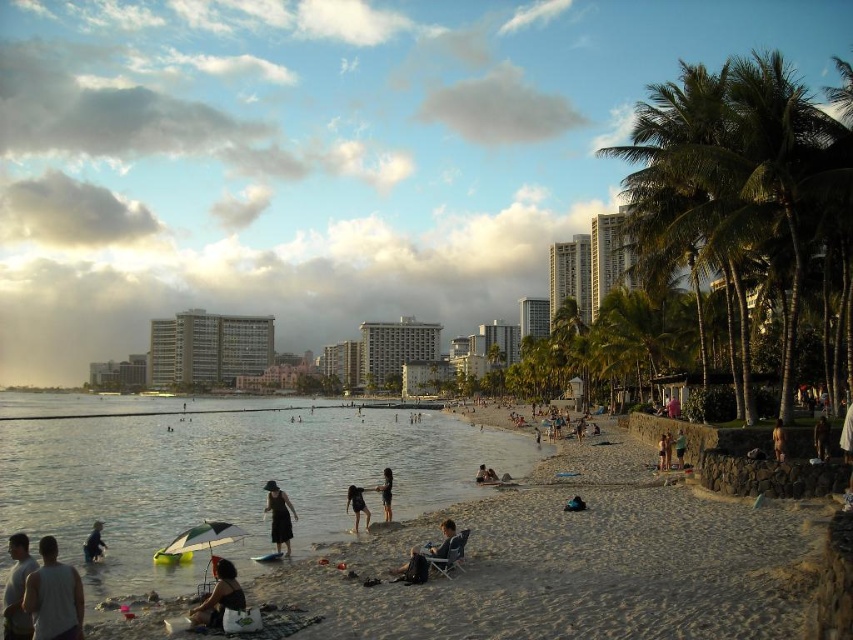
Between white tank top at lower left and dark blue fabric dress at lower center, which one has more height?

With more height is dark blue fabric dress at lower center.

Does white tank top at lower left appear on the left side of dark blue fabric dress at lower center?

Yes, white tank top at lower left is to the left of dark blue fabric dress at lower center.

You are a GUI agent. You are given a task and a screenshot of the screen. Output one action in this format:
    pyautogui.click(x=<x>, y=<y>)
    Task: Click on the white tank top at lower left
    Image resolution: width=853 pixels, height=640 pixels.
    Given the screenshot: What is the action you would take?
    pyautogui.click(x=54, y=596)

Where is `white tank top at lower left`? white tank top at lower left is located at coordinates (54, 596).

Based on the photo, can you confirm if dark brown leather jacket at lower right is bigger than smooth tan skin at lower right?

No.

Is dark brown leather jacket at lower right above smooth tan skin at lower right?

Yes, dark brown leather jacket at lower right is above smooth tan skin at lower right.

Identify the location of dark brown leather jacket at lower right. [679, 449].

Does light brown fabric shirt at lower left have a greater width compared to dark blue fabric at lower left?

Yes.

At what (x,y) coordinates should I click in order to perform the action: click on light brown fabric shirt at lower left. Please return your answer as a coordinate pair (x, y). The width and height of the screenshot is (853, 640). Looking at the image, I should click on (16, 589).